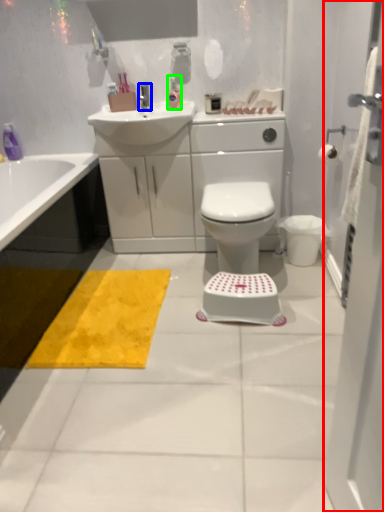
Question: Which is farther away from screen door (highlighted by a red box)? tap (highlighted by a blue box) or toiletry (highlighted by a green box)?

Choices:
 (A) tap
 (B) toiletry

Answer: (A)